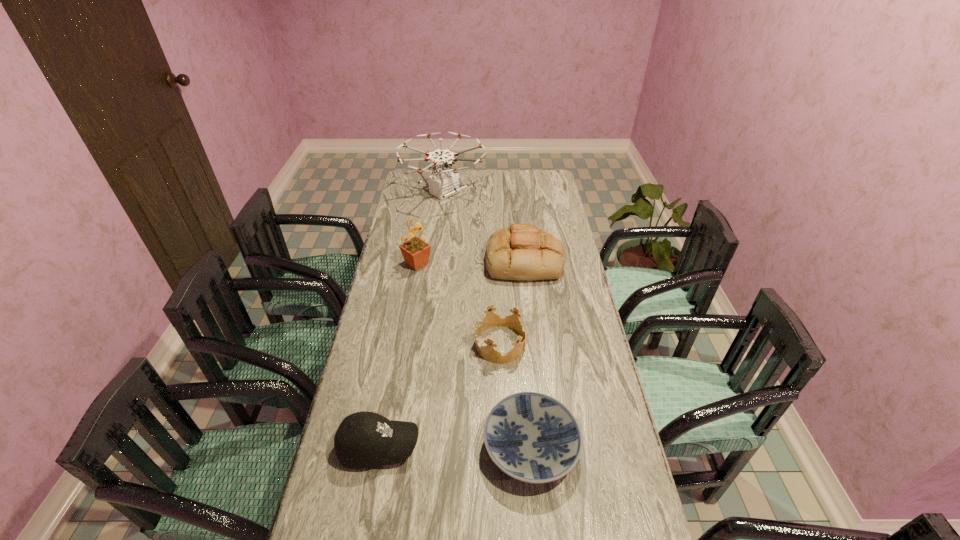
The height and width of the screenshot is (540, 960). Find the location of `drone`. drone is located at coordinates (444, 182).

I want to click on the tallest object, so click(x=444, y=182).

Locate an element on the screen. The width and height of the screenshot is (960, 540). the fifth shortest object is located at coordinates (415, 251).

You are a GUI agent. You are given a task and a screenshot of the screen. Output one action in this format:
    pyautogui.click(x=<x>, y=<y>)
    Task: Click on the bread
    
    Given the screenshot: What is the action you would take?
    pyautogui.click(x=522, y=252)

Locate an element on the screen. The image size is (960, 540). baseball cap is located at coordinates (363, 439).

At what (x,y) coordinates should I click in order to perform the action: click on the fourth farthest object. Please return your answer as a coordinate pair (x, y). This screenshot has width=960, height=540. Looking at the image, I should click on (491, 319).

Identify the location of plate. The width and height of the screenshot is (960, 540). (534, 438).

The width and height of the screenshot is (960, 540). Find the location of `vacant area situated 0.200m on the front of the drone`. vacant area situated 0.200m on the front of the drone is located at coordinates (438, 242).

What are the coordinates of `free region located 0.170m at the front of the sunflower with flowers visible` in the screenshot? It's located at (474, 264).

Locate an element on the screen. vacant space located on the front of the bread is located at coordinates (529, 301).